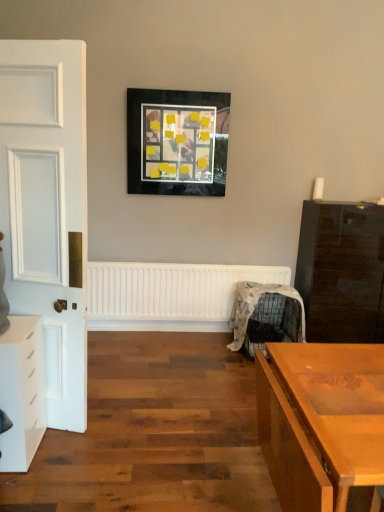
This screenshot has height=512, width=384. What do you see at coordinates (169, 294) in the screenshot? I see `white matte radiator at center` at bounding box center [169, 294].

What is the approximate width of metallic wire swivel chair at center-right?

The width of metallic wire swivel chair at center-right is 22.54 inches.

Locate an element on the screen. white matte chest of drawers at left, the first chest of drawers in the front-to-back sequence is located at coordinates (22, 392).

The image size is (384, 512). Identify the location of glossy dark wood chest of drawers at right, the 2th chest of drawers when ordered from left to right. (342, 272).

The width and height of the screenshot is (384, 512). What are the coordinates of `white matte radiator at center` in the screenshot? It's located at point(169,294).

Could you measure the distance between glossy dark wood chest of drawers at right, which ranks as the 1th chest of drawers in right-to-left order, and white matte chest of drawers at left, the second chest of drawers viewed from the right?

7.98 feet.

Is glossy dark wood chest of drawers at right, which is the first chest of drawers from back to front, not close to white matte chest of drawers at left, the first chest of drawers in the front-to-back sequence?

Yes.

Considering the sizes of glossy dark wood chest of drawers at right, which ranks as the 1th chest of drawers in right-to-left order, and white matte chest of drawers at left, the first chest of drawers in the front-to-back sequence, in the image, is glossy dark wood chest of drawers at right, which ranks as the 1th chest of drawers in right-to-left order, wider or thinner than white matte chest of drawers at left, the first chest of drawers in the front-to-back sequence,?

Clearly, glossy dark wood chest of drawers at right, which ranks as the 1th chest of drawers in right-to-left order, has more width compared to white matte chest of drawers at left, the first chest of drawers in the front-to-back sequence.

Considering the relative positions of glossy dark wood chest of drawers at right, which is counted as the second chest of drawers, starting from the front, and white matte chest of drawers at left, the first chest of drawers in the front-to-back sequence, in the image provided, is glossy dark wood chest of drawers at right, which is counted as the second chest of drawers, starting from the front, to the right of white matte chest of drawers at left, the first chest of drawers in the front-to-back sequence, from the viewer's perspective?

Yes, glossy dark wood chest of drawers at right, which is counted as the second chest of drawers, starting from the front, is to the right of white matte chest of drawers at left, the first chest of drawers in the front-to-back sequence.

Would you consider metallic wire swivel chair at center-right to be distant from matte black picture frame at upper center?

metallic wire swivel chair at center-right is positioned a significant distance from matte black picture frame at upper center.

Does metallic wire swivel chair at center-right turn towards matte black picture frame at upper center?

No, metallic wire swivel chair at center-right is not aimed at matte black picture frame at upper center.

Does metallic wire swivel chair at center-right have a smaller size compared to matte black picture frame at upper center?

No, metallic wire swivel chair at center-right is not smaller than matte black picture frame at upper center.

From the image's perspective, between white matte radiator at center and glossy dark wood chest of drawers at right, which is counted as the second chest of drawers, starting from the front, which one is located above?

glossy dark wood chest of drawers at right, which is counted as the second chest of drawers, starting from the front.

Can you tell me how much white matte radiator at center and glossy dark wood chest of drawers at right, which ranks as the 1th chest of drawers in right-to-left order, differ in facing direction?

white matte radiator at center and glossy dark wood chest of drawers at right, which ranks as the 1th chest of drawers in right-to-left order, are facing 0.0657 degrees away from each other.

Is white matte radiator at center taller or shorter than glossy dark wood chest of drawers at right, which is counted as the second chest of drawers, starting from the front?

white matte radiator at center is shorter than glossy dark wood chest of drawers at right, which is counted as the second chest of drawers, starting from the front.

Which of these two, metallic wire swivel chair at center-right or glossy dark wood chest of drawers at right, which ranks as the 1th chest of drawers in right-to-left order, is thinner?

With smaller width is glossy dark wood chest of drawers at right, which ranks as the 1th chest of drawers in right-to-left order.

Is metallic wire swivel chair at center-right further to camera compared to glossy dark wood chest of drawers at right, which is the first chest of drawers from back to front?

No, it is in front of glossy dark wood chest of drawers at right, which is the first chest of drawers from back to front.

Can you tell me how much metallic wire swivel chair at center-right and glossy dark wood chest of drawers at right, which is the first chest of drawers from back to front, differ in facing direction?

There is a 1.56-degree angle between the facing directions of metallic wire swivel chair at center-right and glossy dark wood chest of drawers at right, which is the first chest of drawers from back to front.

Is metallic wire swivel chair at center-right far away from glossy dark wood chest of drawers at right, which ranks as the 1th chest of drawers in right-to-left order?

metallic wire swivel chair at center-right is actually quite close to glossy dark wood chest of drawers at right, which ranks as the 1th chest of drawers in right-to-left order.

Does white matte chest of drawers at left, the second chest of drawers viewed from the right, lie behind white matte radiator at center?

That is False.

Between white matte chest of drawers at left, the first chest of drawers in the front-to-back sequence, and white matte radiator at center, which one has larger width?

Wider between the two is white matte chest of drawers at left, the first chest of drawers in the front-to-back sequence.

Considering the relative sizes of white matte chest of drawers at left, the second chest of drawers viewed from the right, and white matte radiator at center in the image provided, is white matte chest of drawers at left, the second chest of drawers viewed from the right, smaller than white matte radiator at center?

Correct, white matte chest of drawers at left, the second chest of drawers viewed from the right, occupies less space than white matte radiator at center.

In the scene shown: From a real-world perspective, is matte black picture frame at upper center physically located above or below glossy dark wood chest of drawers at right, which is the first chest of drawers from back to front?

In terms of real-world spatial position, matte black picture frame at upper center is above glossy dark wood chest of drawers at right, which is the first chest of drawers from back to front.

Would you say matte black picture frame at upper center contains glossy dark wood chest of drawers at right, which ranks as the 1th chest of drawers in right-to-left order?

No.

Considering the relative positions of matte black picture frame at upper center and glossy dark wood chest of drawers at right, which is the first chest of drawers from back to front, in the image provided, is matte black picture frame at upper center to the left or to the right of glossy dark wood chest of drawers at right, which is the first chest of drawers from back to front,?

In the image, matte black picture frame at upper center appears on the left side of glossy dark wood chest of drawers at right, which is the first chest of drawers from back to front.

In the image, is white matte radiator at center on the left side or the right side of metallic wire swivel chair at center-right?

In the image, white matte radiator at center appears on the left side of metallic wire swivel chair at center-right.

Can you see white matte radiator at center touching metallic wire swivel chair at center-right?

white matte radiator at center is not next to metallic wire swivel chair at center-right, and they're not touching.

Relative to metallic wire swivel chair at center-right, is white matte radiator at center in front or behind?

white matte radiator at center is positioned farther from the viewer than metallic wire swivel chair at center-right.

Is metallic wire swivel chair at center-right located within white matte radiator at center?

No, white matte radiator at center does not contain metallic wire swivel chair at center-right.

The image size is (384, 512). I want to click on the chest of drawers located underneath the glossy dark wood chest of drawers at right, the 2th chest of drawers when ordered from left to right (from a real-world perspective), so click(x=22, y=392).

Image resolution: width=384 pixels, height=512 pixels. In order to click on swivel chair lying below the matte black picture frame at upper center (from the image's perspective) in this screenshot , I will do `click(254, 307)`.

Which object lies nearer to the anchor point glossy dark wood chest of drawers at right, the 2th chest of drawers when ordered from left to right, metallic wire swivel chair at center-right or matte black picture frame at upper center?

Based on the image, metallic wire swivel chair at center-right appears to be nearer to glossy dark wood chest of drawers at right, the 2th chest of drawers when ordered from left to right.

Considering their positions, is white matte chest of drawers at left, the first chest of drawers in the front-to-back sequence, positioned further to glossy dark wood chest of drawers at right, which ranks as the 1th chest of drawers in right-to-left order, than metallic wire swivel chair at center-right?

The object further to glossy dark wood chest of drawers at right, which ranks as the 1th chest of drawers in right-to-left order, is white matte chest of drawers at left, the first chest of drawers in the front-to-back sequence.

Looking at the image, which one is located closer to matte black picture frame at upper center, white matte radiator at center or glossy dark wood chest of drawers at right, which is counted as the second chest of drawers, starting from the front?

Based on the image, white matte radiator at center appears to be nearer to matte black picture frame at upper center.

Estimate the real-world distances between objects in this image. Which object is further from glossy dark wood chest of drawers at right, the 2th chest of drawers when ordered from left to right, metallic wire swivel chair at center-right or white matte radiator at center?

white matte radiator at center is further to glossy dark wood chest of drawers at right, the 2th chest of drawers when ordered from left to right.

Considering their positions, is matte black picture frame at upper center positioned further to white matte chest of drawers at left, which is the first chest of drawers from left to right, than metallic wire swivel chair at center-right?

matte black picture frame at upper center.

From the picture: Based on their spatial positions, is matte black picture frame at upper center or white matte radiator at center further from white matte chest of drawers at left, the second chest of drawers viewed from the right?

The object further to white matte chest of drawers at left, the second chest of drawers viewed from the right, is matte black picture frame at upper center.

When comparing their distances from metallic wire swivel chair at center-right, does white matte chest of drawers at left, which is the first chest of drawers from left to right, or matte black picture frame at upper center seem closer?

Among the two, matte black picture frame at upper center is located nearer to metallic wire swivel chair at center-right.

Looking at the image, which one is located further to metallic wire swivel chair at center-right, white matte radiator at center or matte black picture frame at upper center?

Among the two, matte black picture frame at upper center is located further to metallic wire swivel chair at center-right.

Where is `swivel chair between white matte chest of drawers at left, the second chest of drawers viewed from the right, and glossy dark wood chest of drawers at right, which ranks as the 1th chest of drawers in right-to-left order, in the horizontal direction`? Image resolution: width=384 pixels, height=512 pixels. swivel chair between white matte chest of drawers at left, the second chest of drawers viewed from the right, and glossy dark wood chest of drawers at right, which ranks as the 1th chest of drawers in right-to-left order, in the horizontal direction is located at coordinates click(x=254, y=307).

Image resolution: width=384 pixels, height=512 pixels. What are the coordinates of `swivel chair between white matte chest of drawers at left, the first chest of drawers in the front-to-back sequence, and white matte radiator at center in the front-back direction` in the screenshot? It's located at (254, 307).

This screenshot has height=512, width=384. In order to click on swivel chair located between white matte radiator at center and glossy dark wood chest of drawers at right, which is the first chest of drawers from back to front, in the left-right direction in this screenshot , I will do (x=254, y=307).

Locate an element on the screen. This screenshot has width=384, height=512. picture frame between white matte chest of drawers at left, arranged as the second chest of drawers when viewed from the back, and white matte radiator at center in the front-back direction is located at coordinates (177, 142).